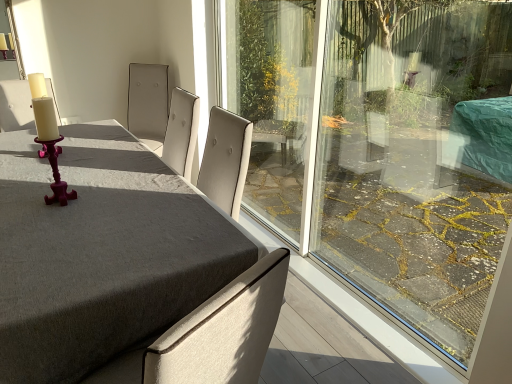
The width and height of the screenshot is (512, 384). Identify the location of matte white chair at left. (15, 106).

Image resolution: width=512 pixels, height=384 pixels. Describe the element at coordinates (48, 137) in the screenshot. I see `matte purple candlestick at left` at that location.

Identify the location of matte white chair at left. (15, 106).

From the image's perspective, is matte white chair at left above matte purple candlestick at left?

Yes, from the image's perspective, matte white chair at left is on top of matte purple candlestick at left.

Which object is positioned more to the left, matte white chair at left or matte purple candlestick at left?

matte white chair at left is more to the left.

Is point (55, 111) less distant than point (47, 198)?

No, (55, 111) is further to viewer.

Does matte white chair at left have a lesser width compared to matte purple candlestick at left?

In fact, matte white chair at left might be wider than matte purple candlestick at left.

Does matte white chair at left contain matte gray table at center?

Definitely not — matte gray table at center is not inside matte white chair at left.

From the image's perspective, is matte white chair at left below matte gray table at center?

No.

Considering the relative positions of matte white chair at left and matte gray table at center in the image provided, is matte white chair at left to the left of matte gray table at center from the viewer's perspective?

Indeed, matte white chair at left is positioned on the left side of matte gray table at center.

Between matte white chair at left and matte gray table at center, which one has smaller width?

matte white chair at left is thinner.

Locate an element on the screen. The height and width of the screenshot is (384, 512). candle holder above the matte gray table at center (from a real-world perspective) is located at coordinates (48, 137).

Looking at this image, in terms of size, does matte purple candlestick at left appear bigger or smaller than matte gray table at center?

In the image, matte purple candlestick at left appears to be smaller than matte gray table at center.

Is point (45, 93) farther from camera compared to point (38, 270)?

Yes, it is.

From the image's perspective, is matte purple candlestick at left on matte gray table at center?

Yes, from the image's perspective, matte purple candlestick at left is above matte gray table at center.

From the image's perspective, is matte gray table at center beneath matte purple candlestick at left?

Yes.

Is matte gray table at center wider or thinner than matte purple candlestick at left?

Considering their sizes, matte gray table at center looks broader than matte purple candlestick at left.

Consider the image. Is matte gray table at center facing towards matte purple candlestick at left?

No, matte gray table at center is not turned towards matte purple candlestick at left.

In the scene shown: Does matte gray table at center have a smaller size compared to matte purple candlestick at left?

Incorrect, matte gray table at center is not smaller in size than matte purple candlestick at left.

From a real-world perspective, who is located lower, matte gray table at center or matte white chair at left?

matte gray table at center is physically lower.

Is matte gray table at center behind matte white chair at left?

No, the depth of matte gray table at center is less than that of matte white chair at left.

Does point (80, 283) come in front of point (13, 93)?

Yes, it is in front of point (13, 93).

What's the angular difference between matte gray table at center and matte white chair at left's facing directions?

92.4 degrees.

Is point (62, 192) positioned behind point (11, 81)?

No, (62, 192) is closer to viewer.

In the image, is matte purple candlestick at left on the left side or the right side of matte white chair at left?

Based on their positions, matte purple candlestick at left is located to the right of matte white chair at left.

Which is correct: matte purple candlestick at left is inside matte white chair at left, or outside of it?

matte purple candlestick at left is not inside matte white chair at left, it's outside.

The image size is (512, 384). I want to click on candle holder positioned vertically above the matte white chair at left (from a real-world perspective), so click(x=48, y=137).

You are a GUI agent. You are given a task and a screenshot of the screen. Output one action in this format:
    pyautogui.click(x=<x>, y=<y>)
    Task: Click on the candle holder located on the right of matte white chair at left
    The width and height of the screenshot is (512, 384).
    Given the screenshot: What is the action you would take?
    pyautogui.click(x=48, y=137)

There is a matte gray table at center. Identify the location of chair above it (from a real-world perspective). This screenshot has height=384, width=512. (15, 106).

Based on their spatial positions, is matte purple candlestick at left or matte white chair at left further from matte gray table at center?

The object further to matte gray table at center is matte white chair at left.

Based on the photo, estimate the real-world distances between objects in this image. Which object is closer to matte white chair at left, matte gray table at center or matte purple candlestick at left?

The object closer to matte white chair at left is matte purple candlestick at left.

Looking at the image, which one is located further to matte purple candlestick at left, matte white chair at left or matte gray table at center?

matte white chair at left is positioned further to the anchor matte purple candlestick at left.

Based on their spatial positions, is matte gray table at center or matte white chair at left closer to matte purple candlestick at left?

matte gray table at center lies closer to matte purple candlestick at left than the other object.

From the image, which object appears to be farther from matte white chair at left, matte purple candlestick at left or matte gray table at center?

matte gray table at center lies further to matte white chair at left than the other object.

When comparing their distances from matte gray table at center, does matte white chair at left or matte purple candlestick at left seem closer?

The object closer to matte gray table at center is matte purple candlestick at left.

The height and width of the screenshot is (384, 512). What are the coordinates of `candle holder located between matte gray table at center and matte white chair at left in the depth direction` in the screenshot? It's located at (48, 137).